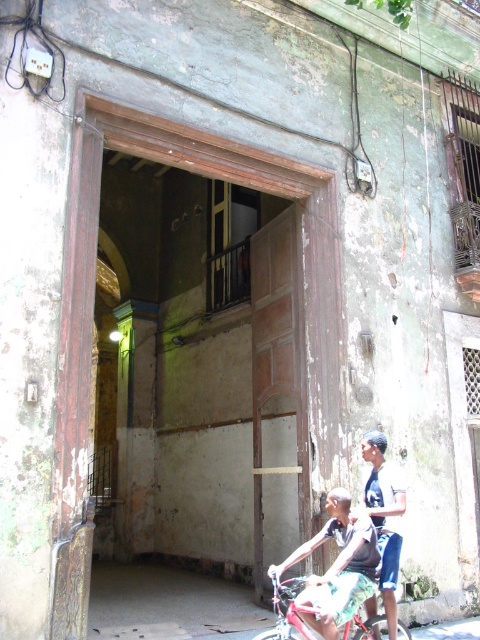
Which is more to the right, dark blue shorts at center or dark blue jersey at center?

dark blue jersey at center is more to the right.

Consider the image. Does dark blue shorts at center appear on the left side of dark blue jersey at center?

Indeed, dark blue shorts at center is positioned on the left side of dark blue jersey at center.

Locate an element on the screen. This screenshot has height=640, width=480. dark blue shorts at center is located at coordinates (365, 528).

Find the location of `dark blue shorts at center`. dark blue shorts at center is located at coordinates (365, 528).

Which is more to the left, dark blue shorts at center or metallic red bicycle at center?

metallic red bicycle at center

Who is taller, dark blue shorts at center or metallic red bicycle at center?

dark blue shorts at center

Which is behind, point (383, 490) or point (350, 637)?

The point (383, 490) is more distant.

This screenshot has width=480, height=640. Identify the location of dark blue shorts at center. (365, 528).

Does dark blue jersey at center have a greater height compared to metallic red bicycle at center?

Yes, dark blue jersey at center is taller than metallic red bicycle at center.

Is dark blue jersey at center to the left of metallic red bicycle at center from the viewer's perspective?

No, dark blue jersey at center is not to the left of metallic red bicycle at center.

This screenshot has height=640, width=480. Find the location of `dark blue jersey at center`. dark blue jersey at center is located at coordinates (384, 516).